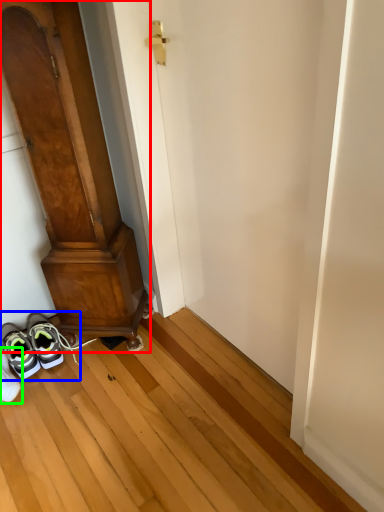
Question: Considering the real-world distances, which object is closest to door (highlighted by a red box)? footwear (highlighted by a blue box) or footwear (highlighted by a green box).

Choices:
 (A) footwear
 (B) footwear

Answer: (A)